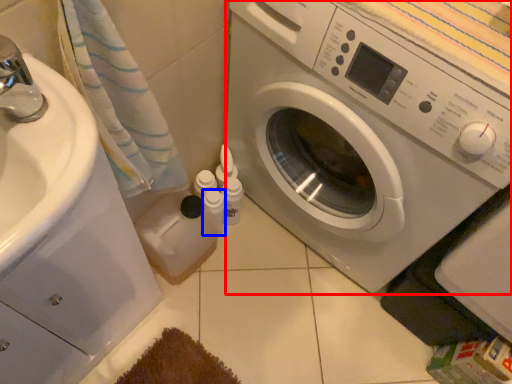
Question: Which object appears closest to the camera in this image, washing machine (highlighted by a red box) or toiletry (highlighted by a blue box)?

Choices:
 (A) washing machine
 (B) toiletry

Answer: (A)